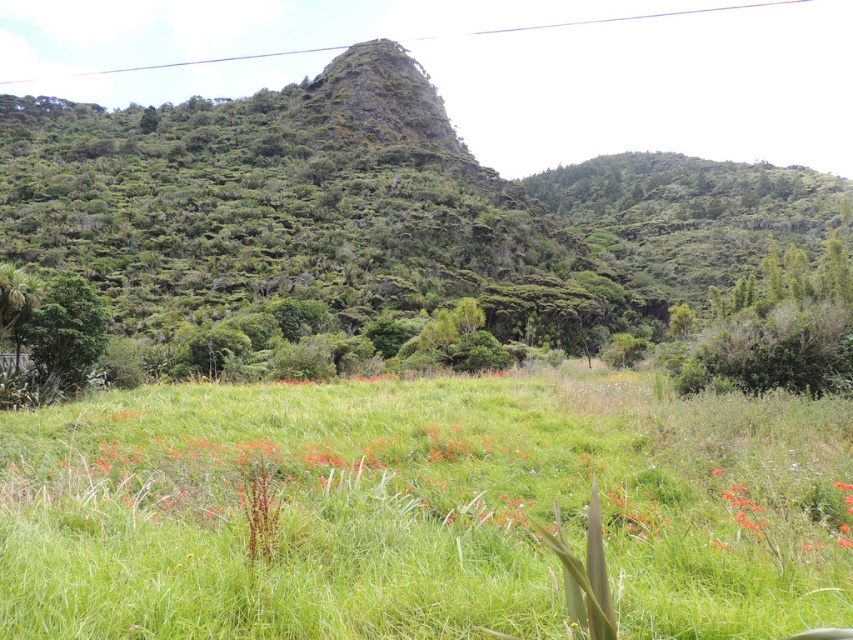
Does green grassy field at center have a greater height compared to green leafy tree at left?

No.

Who is positioned more to the left, green grassy field at center or green leafy tree at left?

green leafy tree at left

You are a GUI agent. You are given a task and a screenshot of the screen. Output one action in this format:
    pyautogui.click(x=<x>, y=<y>)
    Task: Click on the green grassy field at center
    
    Given the screenshot: What is the action you would take?
    pyautogui.click(x=424, y=509)

Locate an element on the screen. Image resolution: width=853 pixels, height=640 pixels. green grassy field at center is located at coordinates (424, 509).

Which is more to the right, green textured hill at upper center or green leafy tree at left?

Positioned to the right is green textured hill at upper center.

Which is in front, point (276, 193) or point (51, 328)?

Positioned in front is point (51, 328).

Image resolution: width=853 pixels, height=640 pixels. Find the location of `green textured hill at upper center`. green textured hill at upper center is located at coordinates (375, 211).

Is green grassy field at center thinner than green textured hill at upper center?

Correct, green grassy field at center's width is less than green textured hill at upper center's.

Measure the distance between green grassy field at center and camera.

The distance of green grassy field at center from camera is 13.34 feet.

This screenshot has width=853, height=640. I want to click on green grassy field at center, so click(x=424, y=509).